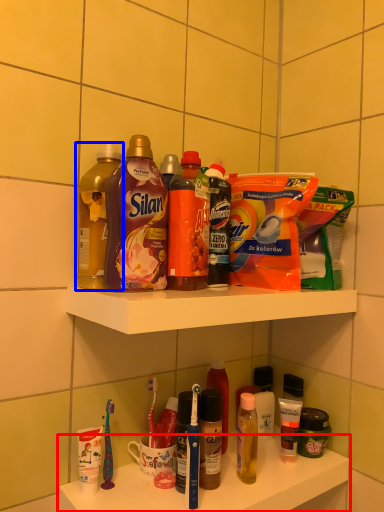
Question: Which object appears farthest to the camera in this image, supermarket shelf (highlighted by a red box) or bottle (highlighted by a blue box)?

Choices:
 (A) supermarket shelf
 (B) bottle

Answer: (B)